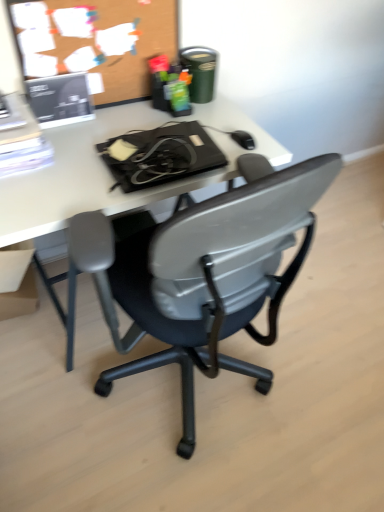
Question: Considering the positions of point (304, 224) and point (0, 285), is point (304, 224) closer or farther from the camera than point (0, 285)?

Choices:
 (A) closer
 (B) farther

Answer: (A)

Question: Is black plastic chair at center to the left or to the right of matte cardboard box at lower left in the image?

Choices:
 (A) right
 (B) left

Answer: (A)

Question: Considering the real-world distances, which object is farthest from the black plastic mouse at upper right?

Choices:
 (A) matte cardboard box at lower left
 (B) black plastic chair at center
 (C) wooden bulletin board at upper left
 (D) white plastic desk at center

Answer: (A)

Question: Estimate the real-world distances between objects in this image. Which object is closer to the wooden bulletin board at upper left?

Choices:
 (A) black plastic chair at center
 (B) white plastic desk at center
 (C) black plastic mouse at upper right
 (D) matte cardboard box at lower left

Answer: (B)